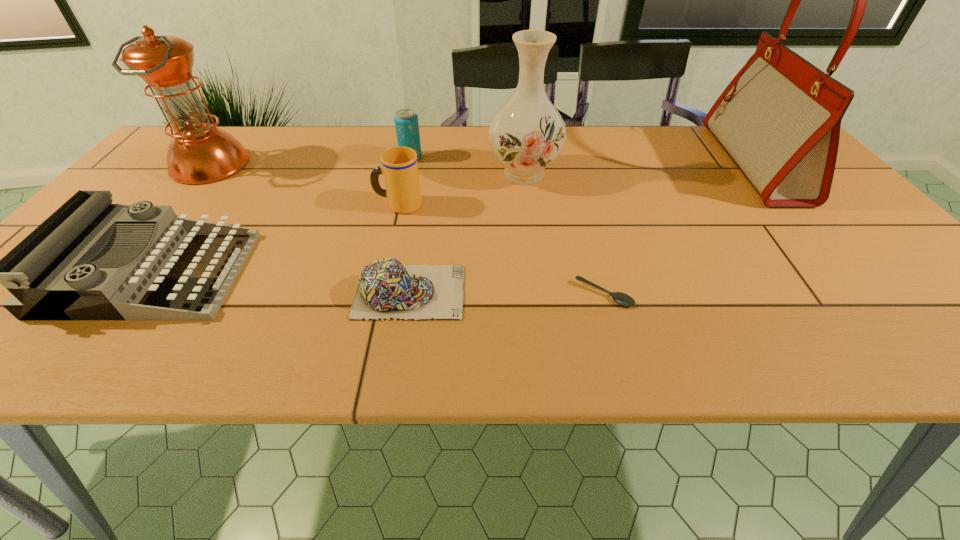
Where is `free spot between the typewriter and the cup`? free spot between the typewriter and the cup is located at coordinates (275, 239).

I want to click on vacant area that lies between the handbag and the vase, so click(638, 169).

At what (x,y) coordinates should I click in order to perform the action: click on object that stands as the fourth closest to the second shortest object. Please return your answer as a coordinate pair (x, y). Image resolution: width=960 pixels, height=540 pixels. Looking at the image, I should click on pos(527,133).

I want to click on object that is the third closest to the typewriter, so click(385, 289).

I want to click on vacant region that satisfies the following two spatial constraints: 1. on the side of the cup with the handle; 2. on the left side of the handbag, so click(x=408, y=164).

Where is `vacant space that satisfies the following two spatial constraints: 1. on the front side of the oil lamp; 2. on the right side of the soupspoon`? vacant space that satisfies the following two spatial constraints: 1. on the front side of the oil lamp; 2. on the right side of the soupspoon is located at coordinates (104, 294).

The height and width of the screenshot is (540, 960). Identify the location of free space that satisfies the following two spatial constraints: 1. on the front side of the oil lamp; 2. on the left side of the shortest object. (104, 294).